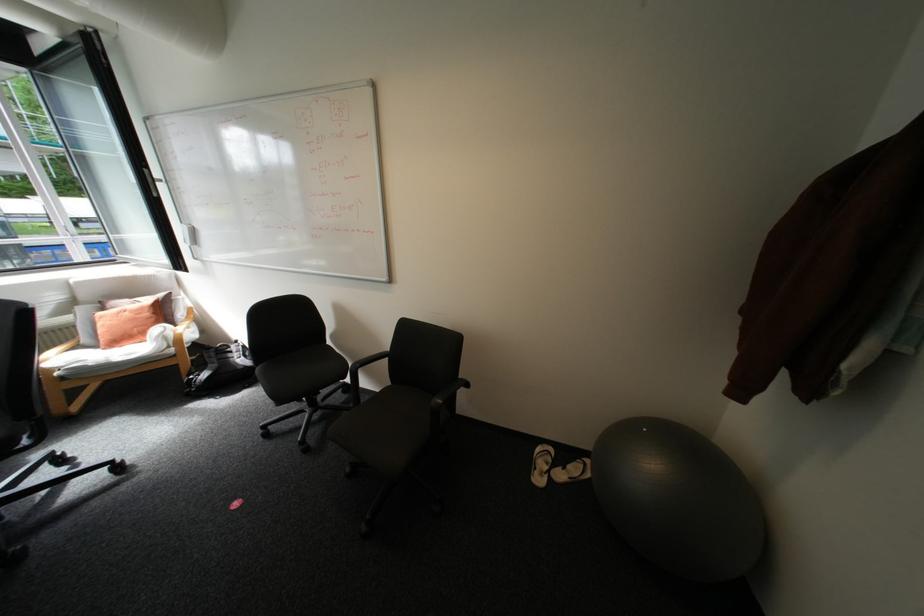
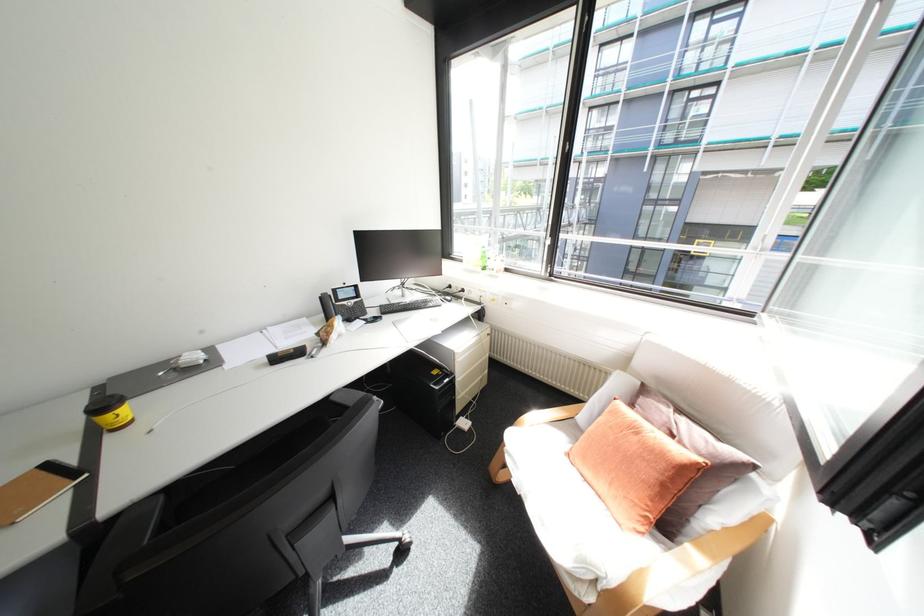
The point at [119,321] is marked in the first image. Where is the corresponding point in the second image?

(621, 428)